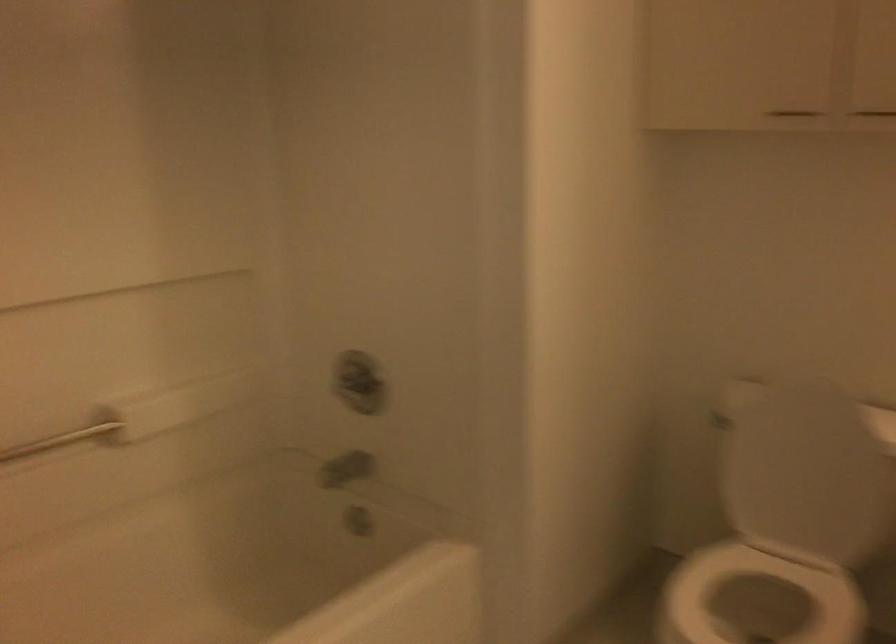
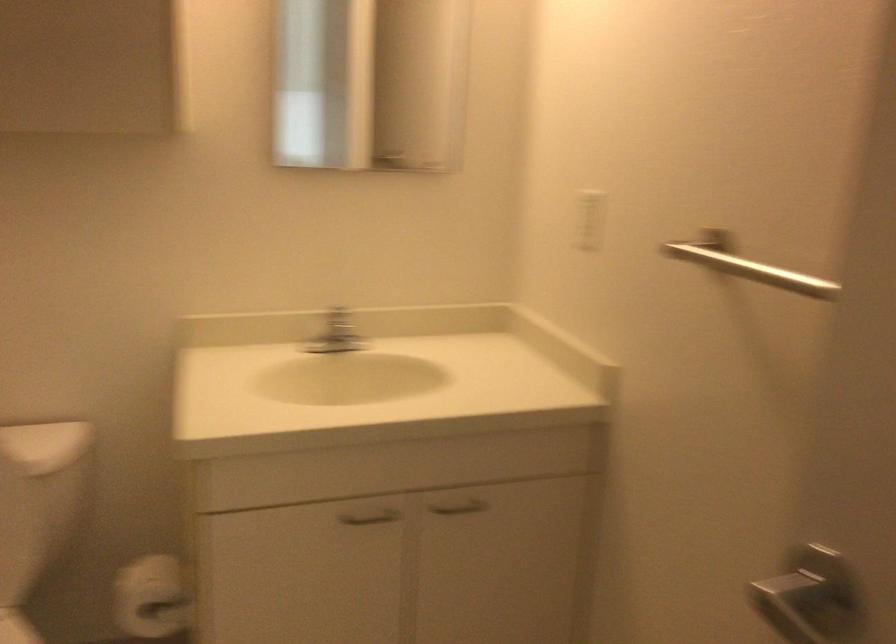
Question: Based on the continuous images, in which direction is the camera rotating? Reply with the corresponding letter.

Choices:
 (A) Left
 (B) Right
 (C) Up
 (D) Down

Answer: (B)